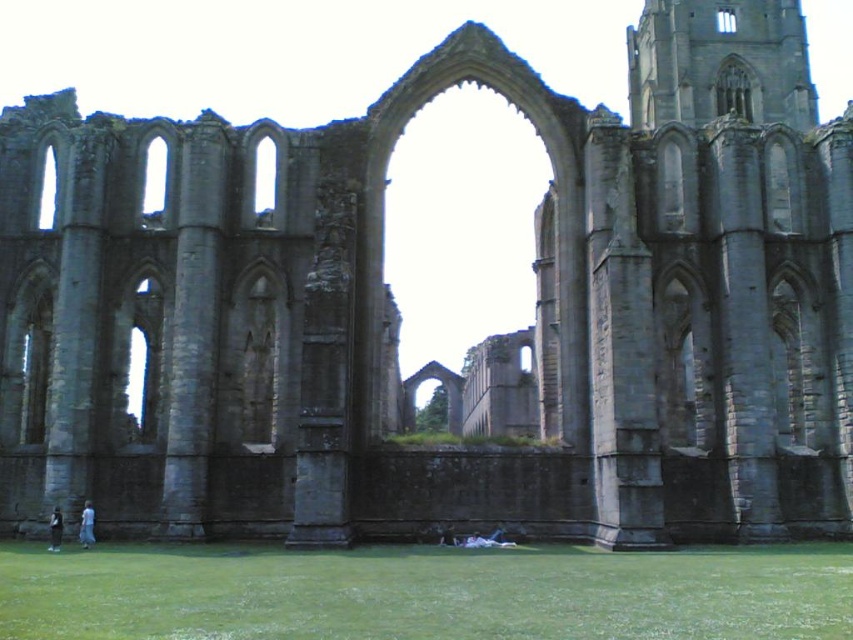
Question: Which point is farther from the camera taking this photo?

Choices:
 (A) (80, 518)
 (B) (248, 627)
 (C) (55, 522)

Answer: (A)

Question: Among these objects, which one is nearest to the camera?

Choices:
 (A) green grass at lower center
 (B) blue fabric dress at lower left
 (C) dark gray fabric jacket at lower left

Answer: (A)

Question: Can you confirm if green grass at lower center is positioned to the left of blue fabric dress at lower left?

Choices:
 (A) yes
 (B) no

Answer: (B)

Question: Which of the following is the farthest from the observer?

Choices:
 (A) (80, 529)
 (B) (756, 582)
 (C) (54, 520)

Answer: (A)

Question: Does blue fabric dress at lower left have a lesser width compared to dark gray fabric jacket at lower left?

Choices:
 (A) yes
 (B) no

Answer: (B)

Question: Is blue fabric dress at lower left above dark gray fabric jacket at lower left?

Choices:
 (A) yes
 (B) no

Answer: (B)